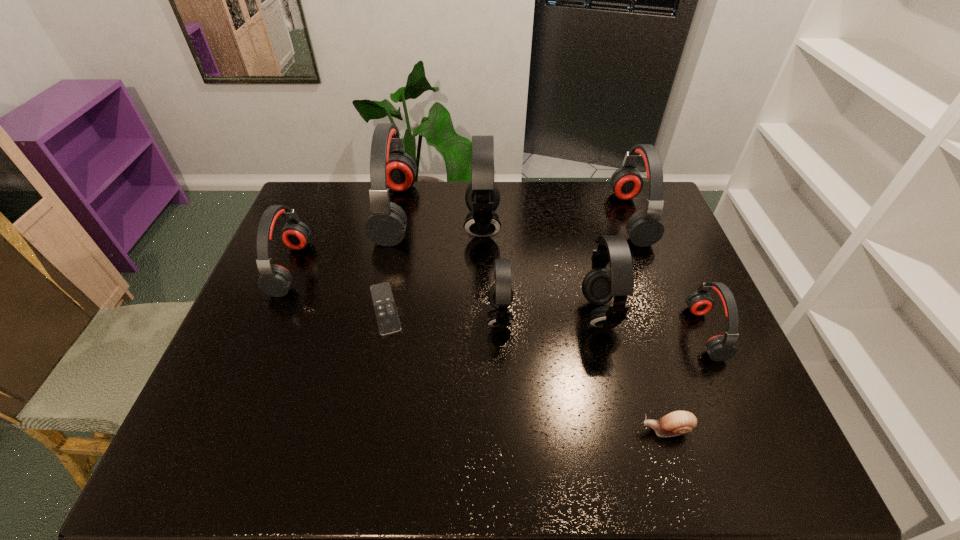
What are the coordinates of `free space located 0.360m on the ear cups of the second biggest red earphone` in the screenshot? It's located at (509, 218).

The height and width of the screenshot is (540, 960). Find the location of `vacant space situated on the ear cups of the second smallest black earphone`. vacant space situated on the ear cups of the second smallest black earphone is located at coordinates point(548,313).

The image size is (960, 540). Identify the location of vacant space situated 0.200m on the ear cups of the second smallest black earphone. (508, 313).

This screenshot has width=960, height=540. Find the location of `vacant area situated on the ear cups of the second smallest black earphone`. vacant area situated on the ear cups of the second smallest black earphone is located at coordinates (478, 313).

Where is `vacant region located 0.270m on the ear cups of the leftmost earphone`? The height and width of the screenshot is (540, 960). vacant region located 0.270m on the ear cups of the leftmost earphone is located at coordinates (396, 268).

This screenshot has height=540, width=960. Identify the location of vacant space located 0.200m on the ear cups of the smallest black earphone. (413, 316).

This screenshot has height=540, width=960. What are the coordinates of `vacant space located on the ear cups of the smallest black earphone` in the screenshot? It's located at (458, 316).

You are a GUI agent. You are given a task and a screenshot of the screen. Output one action in this format:
    pyautogui.click(x=<x>, y=<y>)
    Task: Click on the vacant space located on the ear cups of the smallest black earphone
    
    Given the screenshot: What is the action you would take?
    pyautogui.click(x=361, y=316)

I want to click on vacant space located 0.180m on the ear cups of the nearest red earphone, so click(624, 333).

Identify the location of vacant space located 0.080m on the ear cups of the nearest red earphone. (662, 333).